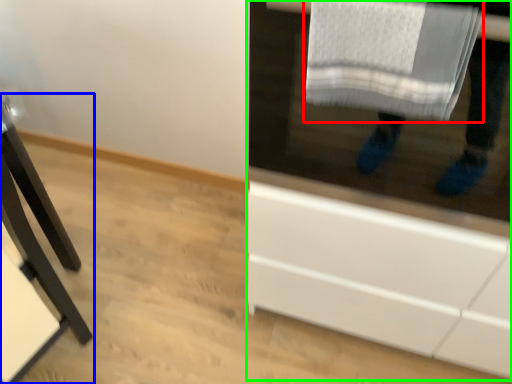
Question: Which object is the closest to the bath towel (highlighted by a red box)? Choose among these: furniture (highlighted by a blue box) or cabinetry (highlighted by a green box).

Choices:
 (A) furniture
 (B) cabinetry

Answer: (B)